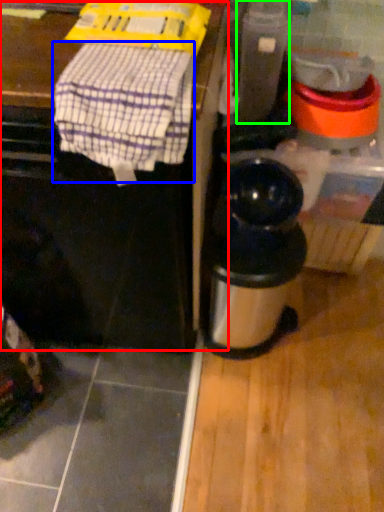
Question: Considering the real-world distances, which object is farthest from vanity (highlighted by a red box)? blanket (highlighted by a blue box) or appliance (highlighted by a green box)?

Choices:
 (A) blanket
 (B) appliance

Answer: (B)